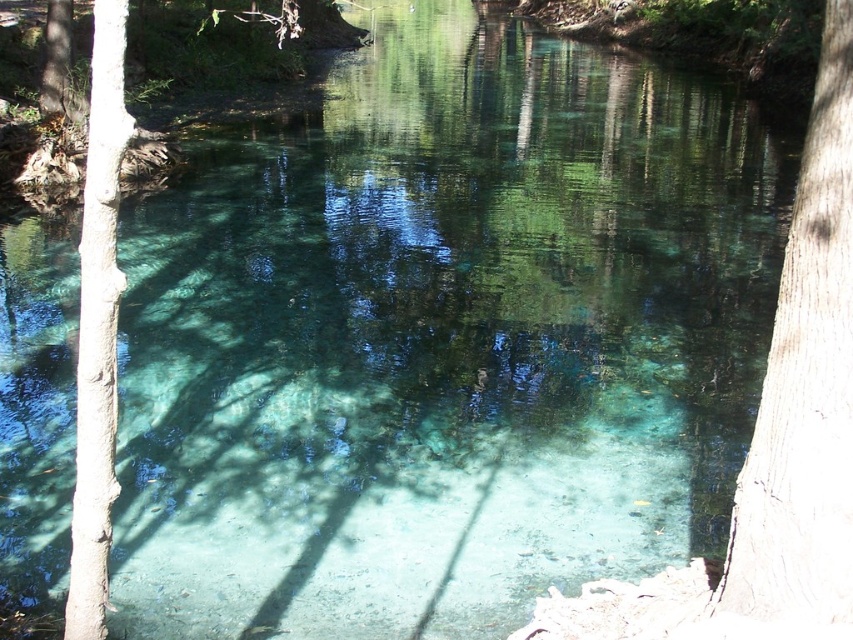
Can you confirm if smooth brown tree trunk at right is positioned to the right of smooth bark tree at left?

Indeed, smooth brown tree trunk at right is positioned on the right side of smooth bark tree at left.

Is point (752, 598) positioned behind point (85, 504)?

Yes, it is behind point (85, 504).

What are the coordinates of `smooth brown tree trunk at right` in the screenshot? It's located at (804, 396).